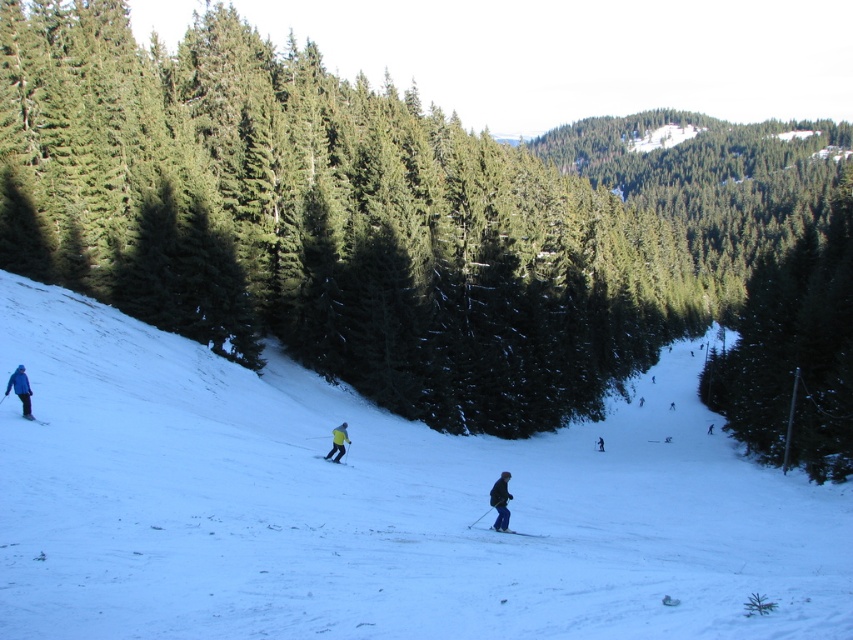
Question: Based on their relative distances, which object is nearer to the dark blue jacket at center?

Choices:
 (A) dark blue ski suit at center
 (B) white snow at center
 (C) matte blue ski at lower left
 (D) matte blue ski at center

Answer: (D)

Question: Can you confirm if yellow fabric ski at center is positioned above matte blue ski at lower left?

Choices:
 (A) yes
 (B) no

Answer: (B)

Question: Can you confirm if green matte tree at right is positioned below blue fabric jacket at lower left?

Choices:
 (A) yes
 (B) no

Answer: (B)

Question: Is yellow fabric skier at center above yellow fabric ski at center?

Choices:
 (A) yes
 (B) no

Answer: (A)

Question: Among these objects, which one is farthest from the camera?

Choices:
 (A) yellow fabric ski at center
 (B) dark blue ski suit at center
 (C) blue fabric jacket at lower left

Answer: (B)

Question: Which is farther from the dark blue jacket at center?

Choices:
 (A) dark blue ski suit at center
 (B) blue fabric jacket at lower left
 (C) green matte tree at right
 (D) matte blue ski at lower left

Answer: (C)